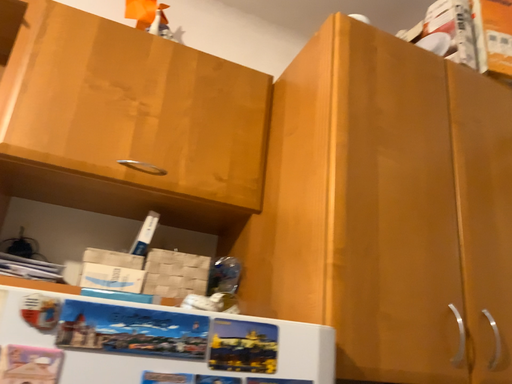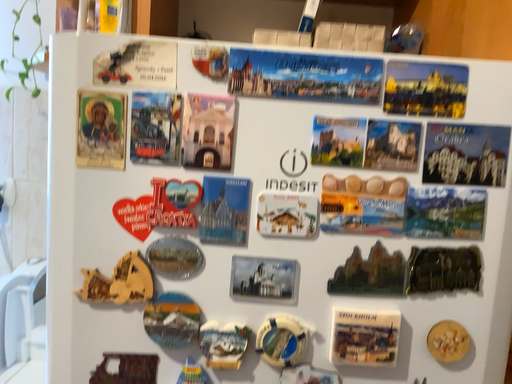
Question: How did the camera likely rotate when shooting the video?

Choices:
 (A) rotated right
 (B) rotated left

Answer: (B)